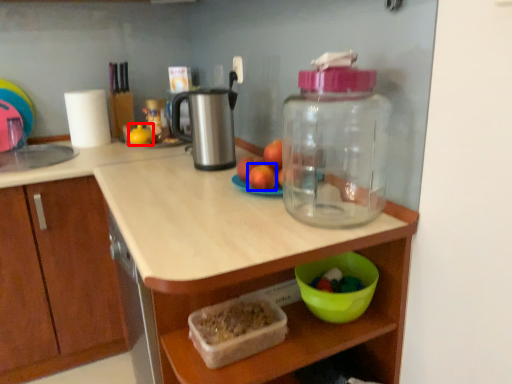
Question: Which object appears farthest to the camera in this image, toy (highlighted by a red box) or apple (highlighted by a blue box)?

Choices:
 (A) toy
 (B) apple

Answer: (A)